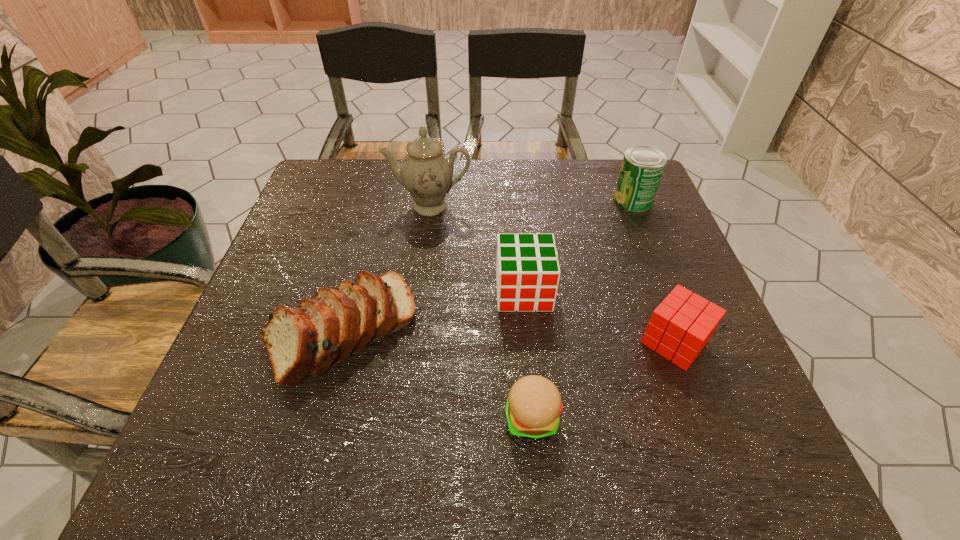
Find the location of a particular element. This screenshot has width=960, height=540. free spot that satisfies the following two spatial constraints: 1. on the back side of the nearer cube; 2. on the right side of the shortest object is located at coordinates (525, 342).

I want to click on free space that satisfies the following two spatial constraints: 1. on the spout of the tallest object; 2. on the left side of the nearest object, so click(x=402, y=417).